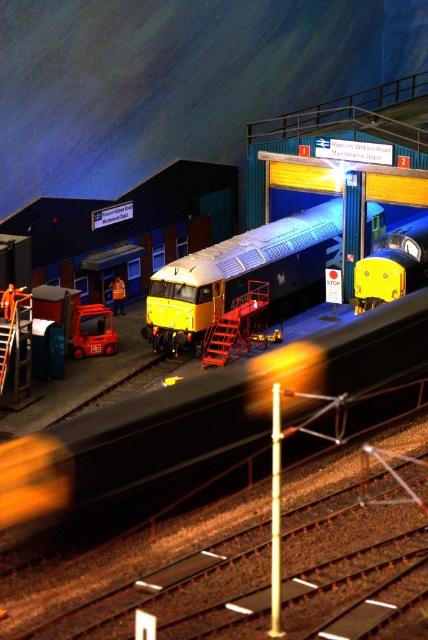
Question: Which object appears closest to the camera in this image?

Choices:
 (A) metallic silver train at center
 (B) metallic yellow train at center
 (C) yellow plastic train at center

Answer: (B)

Question: Considering the relative positions of metallic yellow train at center and yellow plastic train at center in the image provided, where is metallic yellow train at center located with respect to yellow plastic train at center?

Choices:
 (A) left
 (B) right

Answer: (A)

Question: Which of the following is the closest to the observer?

Choices:
 (A) metallic yellow train at center
 (B) metallic silver train at center
 (C) yellow plastic train at center

Answer: (A)

Question: Is metallic silver train at center to the left of yellow plastic train at center from the viewer's perspective?

Choices:
 (A) no
 (B) yes

Answer: (B)

Question: Which point is closer to the camera?

Choices:
 (A) (386, 273)
 (B) (162, 342)

Answer: (B)

Question: Does metallic yellow train at center have a smaller size compared to metallic silver train at center?

Choices:
 (A) no
 (B) yes

Answer: (B)